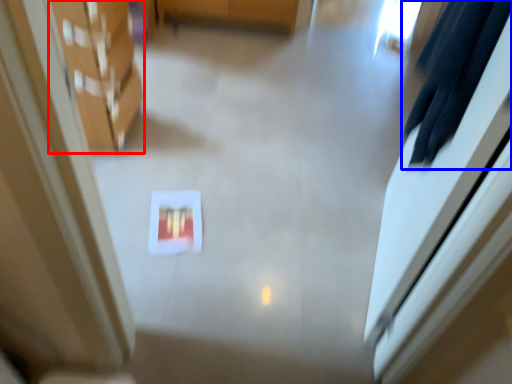
Question: Which object is closer to the camera taking this photo, furniture (highlighted by a red box) or robe (highlighted by a blue box)?

Choices:
 (A) furniture
 (B) robe

Answer: (B)